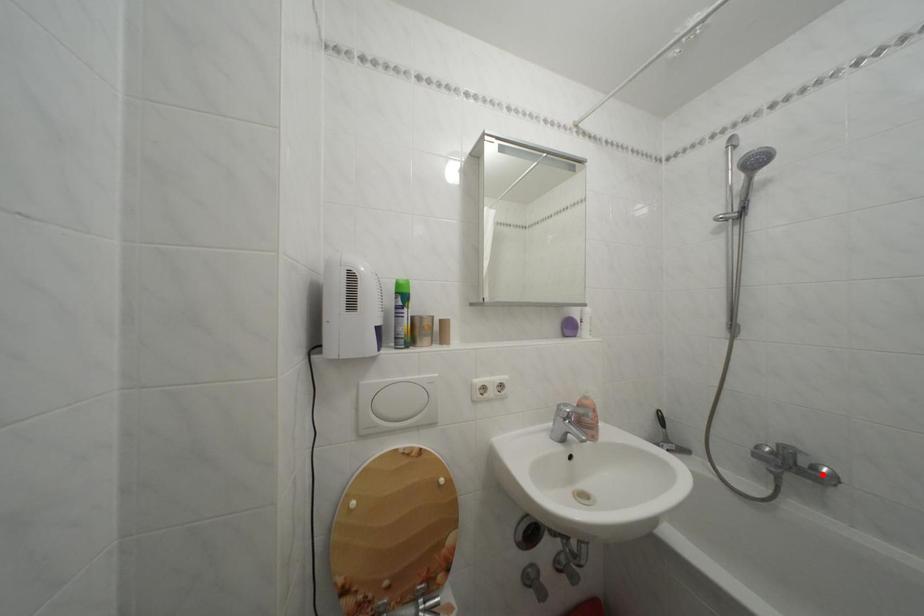
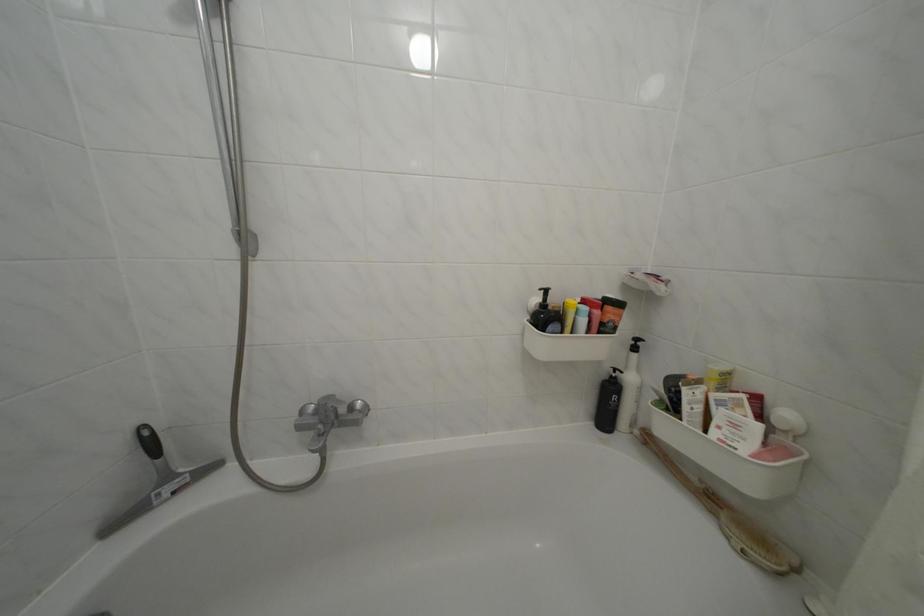
Locate, in the second image, the point that corresponds to the highlighted location in the first image.

(359, 414)